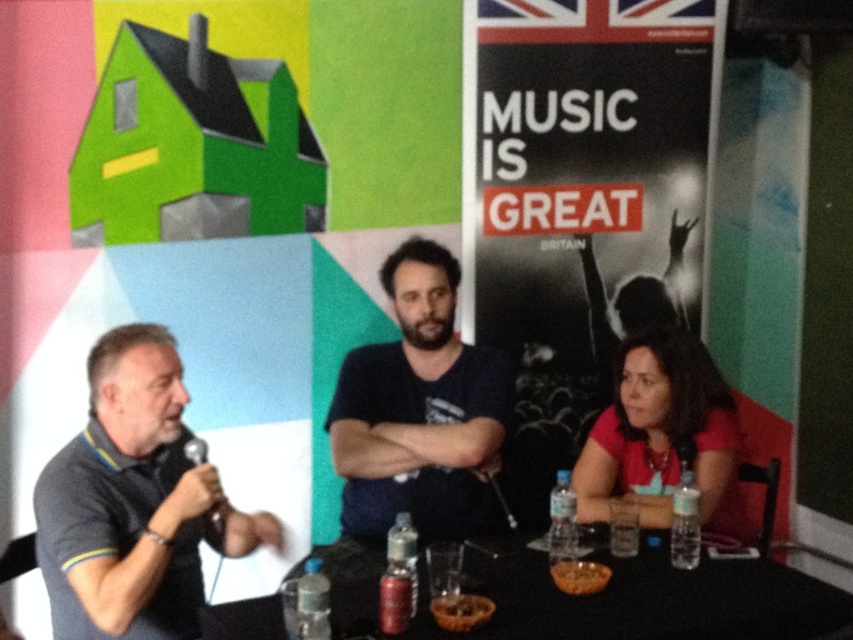
Who is more forward, (665, 388) or (606, 579)?

Point (606, 579) is in front.

Does red matte shirt at lower right lie in front of brown textured bowl at lower center?

No, red matte shirt at lower right is behind brown textured bowl at lower center.

Does point (709, 470) lie in front of point (585, 589)?

No, (709, 470) is behind (585, 589).

Identify the location of red matte shirt at lower right. The height and width of the screenshot is (640, 853). coord(659,432).

Is transparent plastic bottle at table center above clear plastic cup at lower right?

No.

Who is more distant from viewer, [573,534] or [625,556]?

Positioned behind is point [625,556].

Between point (554, 529) and point (630, 504), which one is positioned in front?

Point (554, 529)

At what (x,y) coordinates should I click in order to perform the action: click on transparent plastic bottle at table center. Please return your answer as a coordinate pair (x, y). The image size is (853, 640). Looking at the image, I should click on (561, 518).

The image size is (853, 640). What are the coordinates of `black plastic table at lower center` in the screenshot? It's located at (645, 602).

Is black plastic table at lower center closer to the viewer compared to clear plastic bottle at lower right?

Yes, black plastic table at lower center is closer to the viewer.

You are a GUI agent. You are given a task and a screenshot of the screen. Output one action in this format:
    pyautogui.click(x=<x>, y=<y>)
    Task: Click on the black plastic table at lower center
    
    Given the screenshot: What is the action you would take?
    pyautogui.click(x=645, y=602)

Where is `black plastic table at lower center`? The image size is (853, 640). black plastic table at lower center is located at coordinates (645, 602).